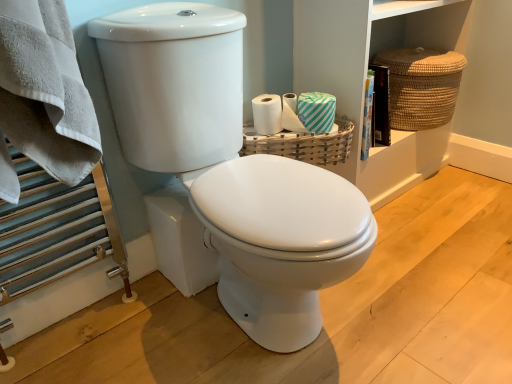
The height and width of the screenshot is (384, 512). Identify the location of free location in front of brown woven basket at upper right. (431, 235).